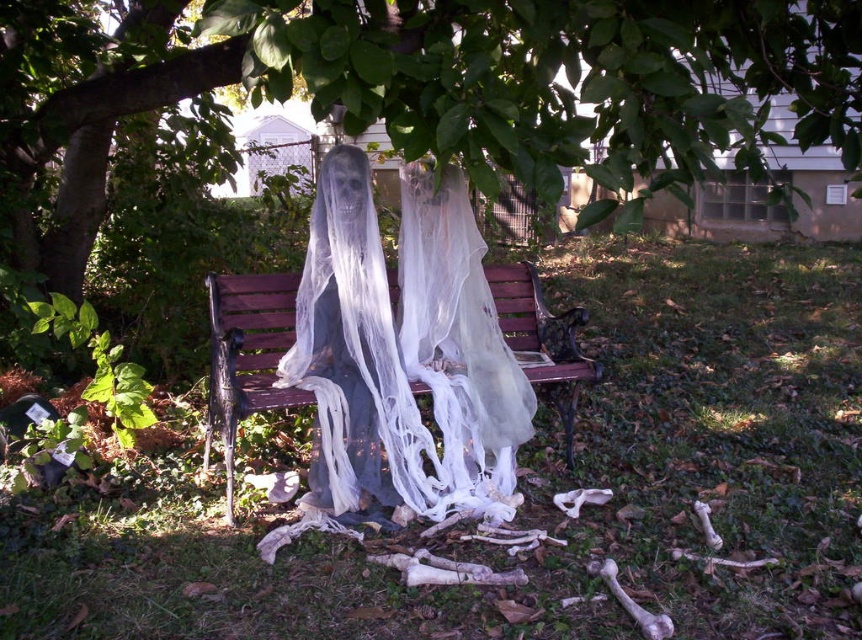
You are a visitor at this Halloween scene and want to take a photo of the green leafy tree at upper center and the wooden bench at center. Which object should you focus on first if you want to capture both in one shot without moving the camera?

The green leafy tree at upper center is located above the wooden bench at center, so you should focus on the green leafy tree at upper center first to ensure both are in frame.

You are a small squirrel that wants to jump from the green leafy tree at upper center to the wooden bench at center. Can you make the jump? Your squirrel body length is 20 cm.

The distance between the green leafy tree at upper center and the wooden bench at center is 1.55 meters, which is 155 cm. Since your squirrel body length is only 20 cm, the jump is too far for you to safely make. You should find a closer branch or object to land on.

You are a visitor at a Halloween event and want to take a photo of the green leafy tree at upper center and the wooden bench at center. Which object should you focus on first if you want to capture both in a single frame without moving the camera?

The green leafy tree at upper center is larger in size than the wooden bench at center, so you should focus on the green leafy tree at upper center first to ensure it fills the frame appropriately while still capturing the wooden bench at center in the background.